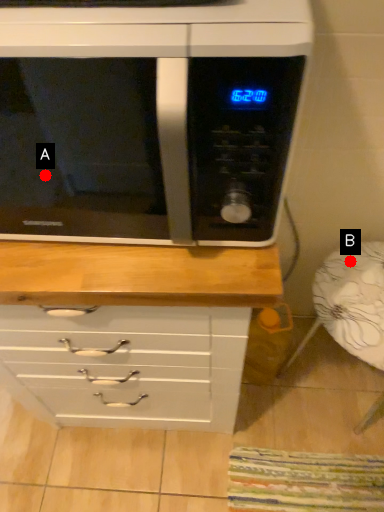
Question: Two points are circled on the image, labeled by A and B beside each circle. Which point is farther from the camera taking this photo?

Choices:
 (A) A is further
 (B) B is further

Answer: (A)